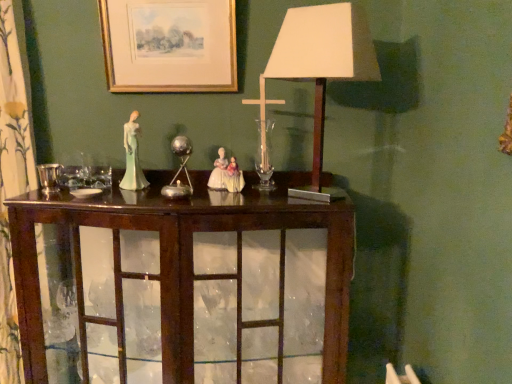
The image size is (512, 384). Identify the location of free space that is in between porcelain figure at center and shiny silver candle holder at left, marked as the second candle holder in a back-to-front arrangement. (81, 193).